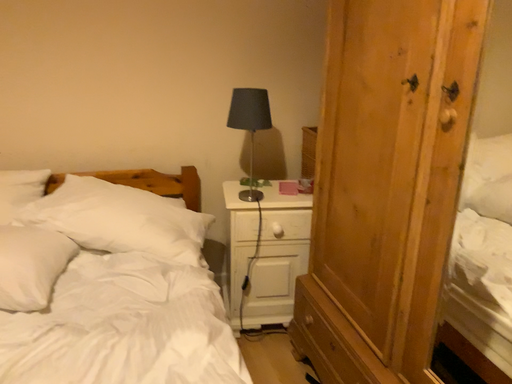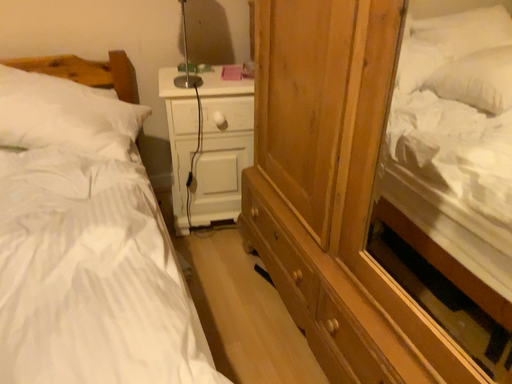
Question: How did the camera likely rotate when shooting the video?

Choices:
 (A) rotated upward
 (B) rotated downward

Answer: (B)